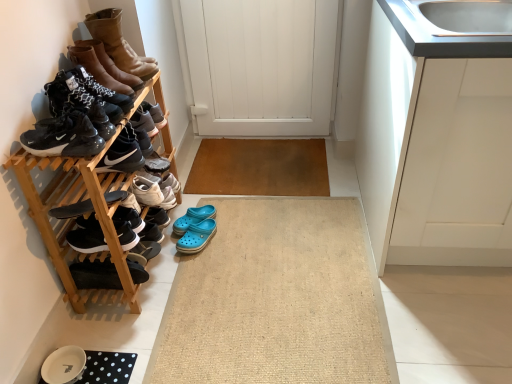
Find the location of a particular element. The width and height of the screenshot is (512, 384). vacant space behind beige woven bath mat at center is located at coordinates (260, 171).